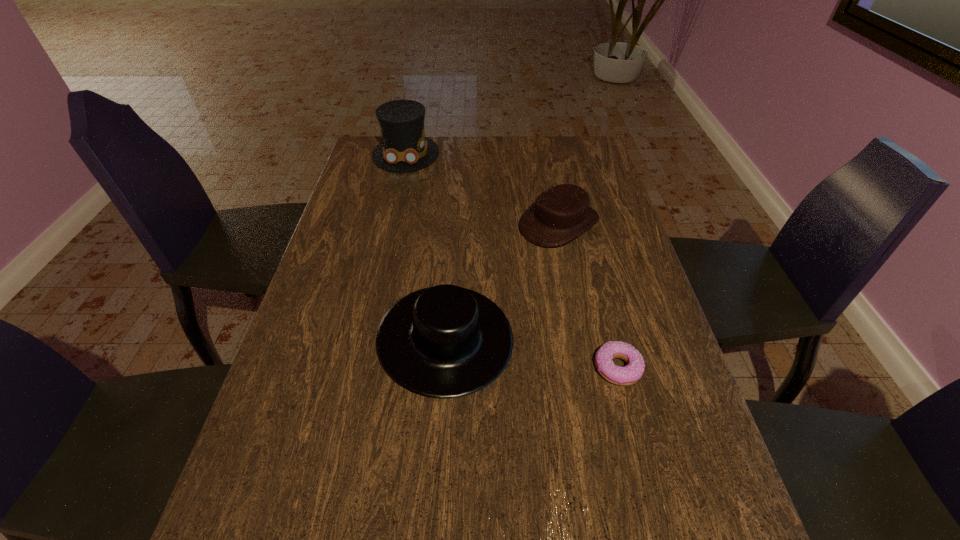
The image size is (960, 540). What are the coordinates of `vacant space at the far right corner of the desktop` in the screenshot? It's located at 588,159.

Where is `free space between the third shortest object and the shortest object`? This screenshot has height=540, width=960. free space between the third shortest object and the shortest object is located at coordinates (532, 354).

Locate an element on the screen. This screenshot has width=960, height=540. free point between the nearest hat and the tallest object is located at coordinates (426, 247).

This screenshot has height=540, width=960. What are the coordinates of `vacant area that lies between the farthest hat and the second tallest hat` in the screenshot? It's located at (426, 247).

In order to click on vacant space that's between the farthest hat and the doughnut in this screenshot , I will do `click(512, 261)`.

You are a GUI agent. You are given a task and a screenshot of the screen. Output one action in this format:
    pyautogui.click(x=<x>, y=<y>)
    Task: Click on the unoccupied area between the second farthest object and the tallest hat
    The width and height of the screenshot is (960, 540).
    Given the screenshot: What is the action you would take?
    pyautogui.click(x=483, y=188)

Where is `empty space between the second farthest hat and the farthest hat`? The height and width of the screenshot is (540, 960). empty space between the second farthest hat and the farthest hat is located at coordinates (483, 188).

Find the location of a particular element. Image resolution: width=960 pixels, height=540 pixels. unoccupied area between the shortest object and the second shortest hat is located at coordinates click(x=532, y=354).

Find the location of a particular element. empty space between the second farthest hat and the farthest object is located at coordinates (483, 188).

Where is `free space between the third tallest object and the farthest hat`? free space between the third tallest object and the farthest hat is located at coordinates (483, 188).